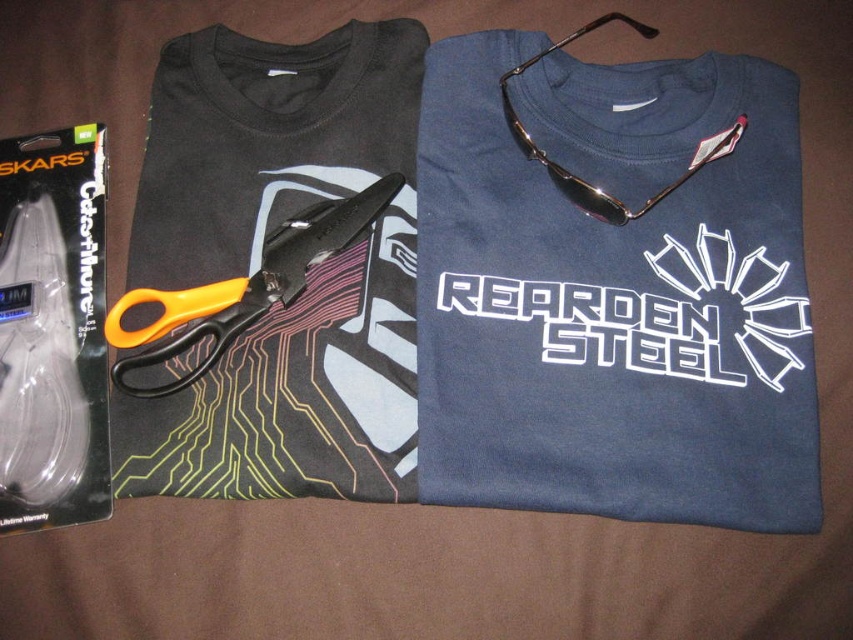
Question: Which of the following is the closest to the observer?

Choices:
 (A) (585, 291)
 (B) (659, 195)

Answer: (A)

Question: Does white glossy text at center appear on the left side of orange plastic scissors at center?

Choices:
 (A) yes
 (B) no

Answer: (B)

Question: Is white glossy text at center positioned at the back of orange plastic scissors at center?

Choices:
 (A) yes
 (B) no

Answer: (B)

Question: Which point is farther to the camera?

Choices:
 (A) white glossy text at center
 (B) orange plastic scissors at center
 (C) dark blue cotton t-shirt at upper center
 (D) metallic gold sunglasses at upper center

Answer: (D)

Question: Among these objects, which one is farthest from the camera?

Choices:
 (A) dark blue cotton t-shirt at upper center
 (B) metallic gold sunglasses at upper center
 (C) orange plastic scissors at center

Answer: (B)

Question: Can you confirm if white glossy text at center is bigger than orange plastic scissors at center?

Choices:
 (A) no
 (B) yes

Answer: (A)